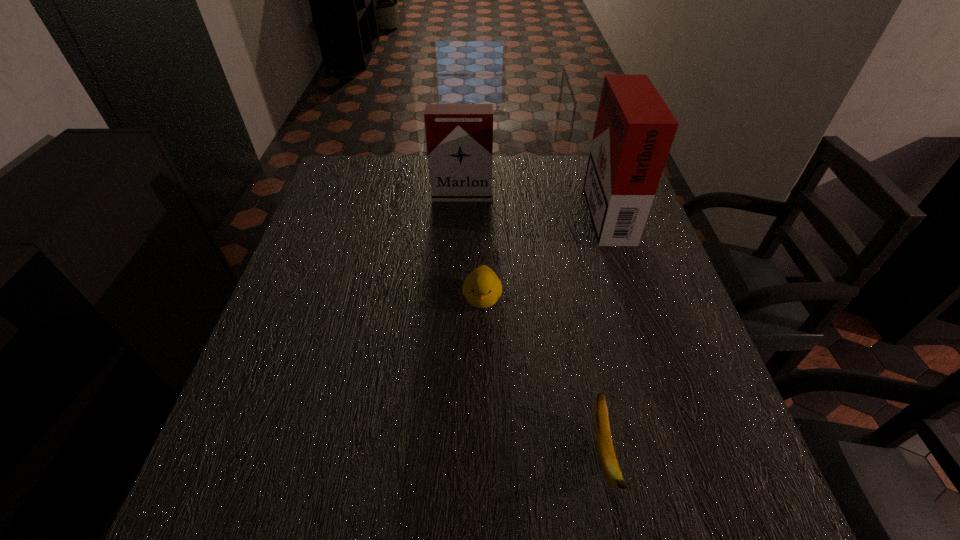
This screenshot has width=960, height=540. I want to click on free space located 0.400m on the front-facing side of the taller cigarette_case, so click(x=446, y=208).

Find the location of `vacant area situated 0.150m on the front-facing side of the shorter cigarette_case`. vacant area situated 0.150m on the front-facing side of the shorter cigarette_case is located at coordinates (460, 235).

This screenshot has height=540, width=960. Identify the location of vacant region located on the front-facing side of the third farthest object. (483, 464).

You are a GUI agent. You are given a task and a screenshot of the screen. Output one action in this format:
    pyautogui.click(x=<x>, y=<y>)
    Task: Click on the object located at the near edge
    The height and width of the screenshot is (540, 960).
    Given the screenshot: What is the action you would take?
    pyautogui.click(x=610, y=467)

What are the coordinates of `object that is at the right edge` in the screenshot? It's located at (634, 131).

Locate an element on the screen. This screenshot has width=960, height=540. object that is positioned at the far right corner is located at coordinates (634, 131).

In order to click on free space at the far edge in this screenshot , I will do `click(533, 197)`.

I want to click on free space at the near edge, so click(x=656, y=490).

Where is `free space at the left edge of the desktop`? Image resolution: width=960 pixels, height=540 pixels. free space at the left edge of the desktop is located at coordinates (291, 379).

Identify the location of blank space at the right edge of the desktop. (681, 366).